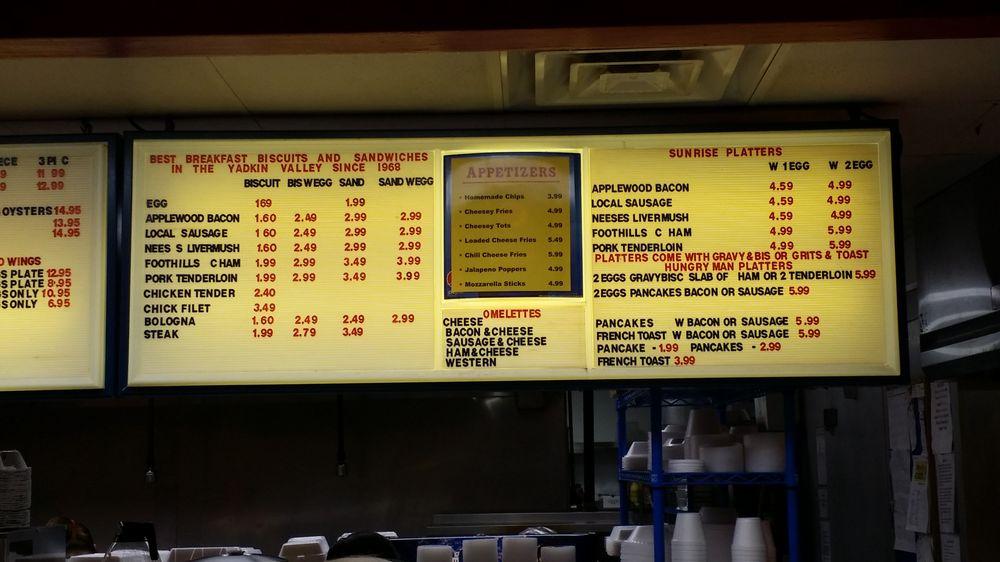
Image resolution: width=1000 pixels, height=562 pixels. I want to click on ceiling tiles, so click(x=343, y=86), click(x=183, y=74), click(x=892, y=65).